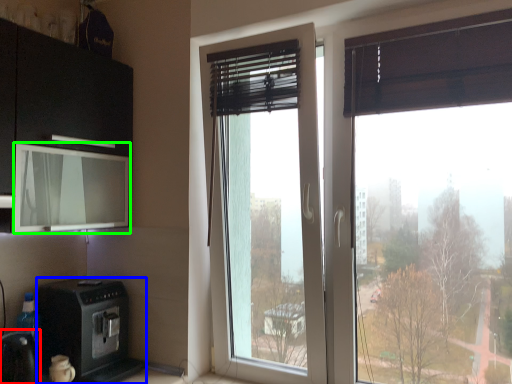
Question: Considering the real-world distances, which object is farthest from appliance (highlighted by a red box)? home appliance (highlighted by a blue box) or window screen (highlighted by a green box)?

Choices:
 (A) home appliance
 (B) window screen

Answer: (B)